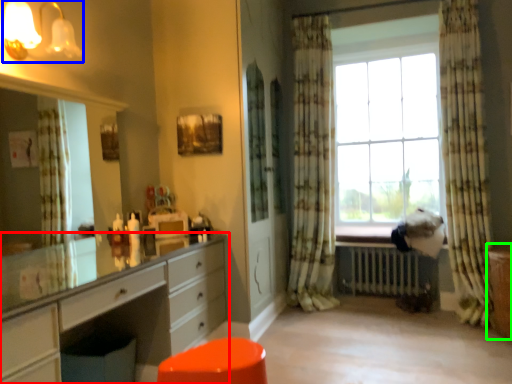
Question: Considering the real-world distances, which object is farthest from chest of drawers (highlighted by a red box)? light fixture (highlighted by a blue box) or file cabinet (highlighted by a green box)?

Choices:
 (A) light fixture
 (B) file cabinet

Answer: (B)